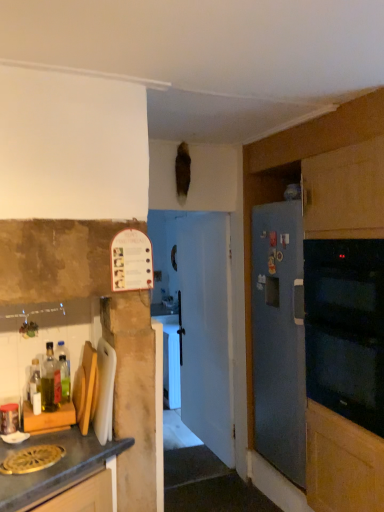
Question: Is black glass oven at right taller or shorter than white plastic cutting board at left?

Choices:
 (A) short
 (B) tall

Answer: (B)

Question: From the image's perspective, is black glass oven at right above or below white plastic cutting board at left?

Choices:
 (A) above
 (B) below

Answer: (A)

Question: Which of these objects is positioned closest to the white plastic cutting board at left?

Choices:
 (A) metallic glass jar at left
 (B) translucent plastic bottle at left, which is the first bottle from back to front
 (C) black glass oven at right
 (D) white glossy door at center
 (E) blue matte refrigerator at right, acting as the 2th cabinetry starting from the front

Answer: (B)

Question: Considering the real-world distances, which object is farthest from the translucent plastic bottle at left, which is the first bottle from back to front?

Choices:
 (A) black glass oven at right
 (B) matte wood cutting board at lower left, positioned as the second cabinetry in back-to-front order
 (C) translucent glass bottle at left, the 2th bottle viewed from the back
 (D) white plastic cutting board at left
 (E) metallic glass jar at left

Answer: (A)